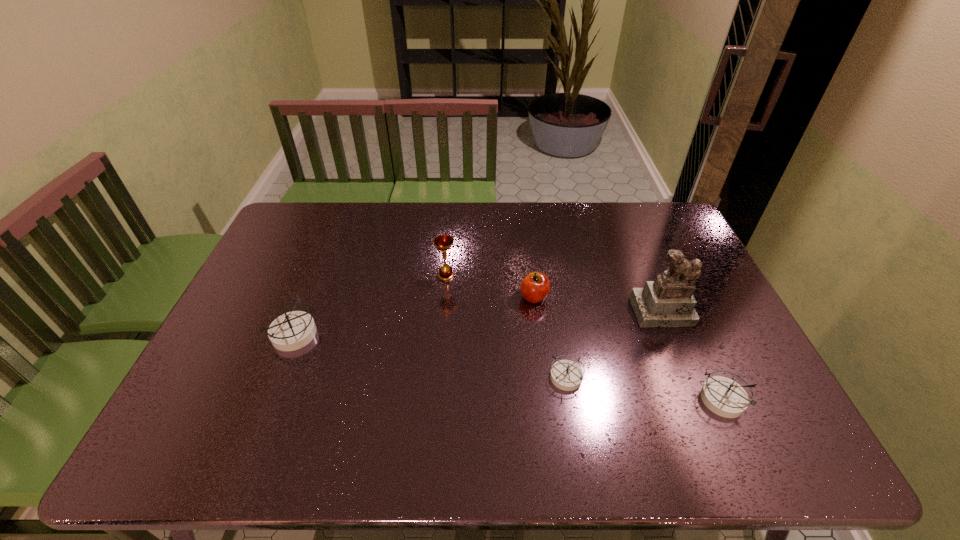
Locate an element on the screen. The width and height of the screenshot is (960, 540). empty space that is in between the tallest object and the second tallest compass is located at coordinates (692, 355).

Locate an element on the screen. This screenshot has height=540, width=960. free space between the tallest object and the tallest compass is located at coordinates (478, 323).

The width and height of the screenshot is (960, 540). I want to click on blank region between the second shortest object and the tallest object, so [692, 355].

This screenshot has height=540, width=960. I want to click on unoccupied position between the chalice and the leftmost compass, so click(370, 305).

I want to click on empty location between the apple and the second compass from right to left, so click(550, 336).

The image size is (960, 540). Identify the location of empty space that is in between the figurine and the chalice. (554, 293).

Find the location of a particular element. The height and width of the screenshot is (540, 960). object that is the closest one to the figurine is located at coordinates (723, 396).

Select which object is the fourth closest to the second compass from right to left. Please provide its 2D coordinates. Your answer should be formatted as a tuple, i.e. [(x, y)], where the tuple contains the x and y coordinates of a point satisfying the conditions above.

[(442, 242)]

Identify the location of the third closest compass to the tallest object. (291, 331).

Point out which compass is positioned as the nearest to the rightmost compass. Please provide its 2D coordinates. Your answer should be formatted as a tuple, i.e. [(x, y)], where the tuple contains the x and y coordinates of a point satisfying the conditions above.

[(567, 375)]